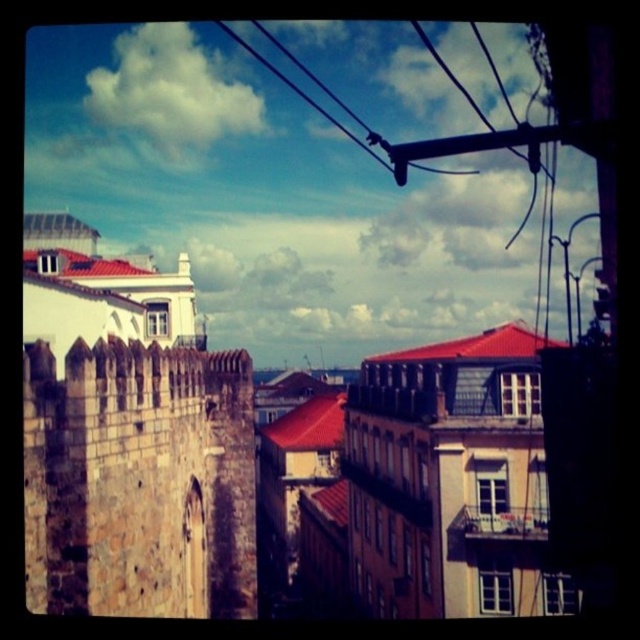
You are an architect analyzing the urban scene. You notice the brown stone wall at left and the black wire at upper center. Which object has a greater thickness in the image?

The black wire at upper center has a greater thickness than the brown stone wall at left according to the description.

You are standing in the urban scene and want to locate the brown stone wall at left. According to the coordinates, where is it positioned?

The brown stone wall at left is positioned at coordinates point (140, 481).

You are a bird flying over the urban scene. You want to land on the highest point between the brown stone wall at left and the black wire at upper center. Which one should you choose?

The black wire at upper center is taller than the brown stone wall at left, so you should land on the black wire at upper center.